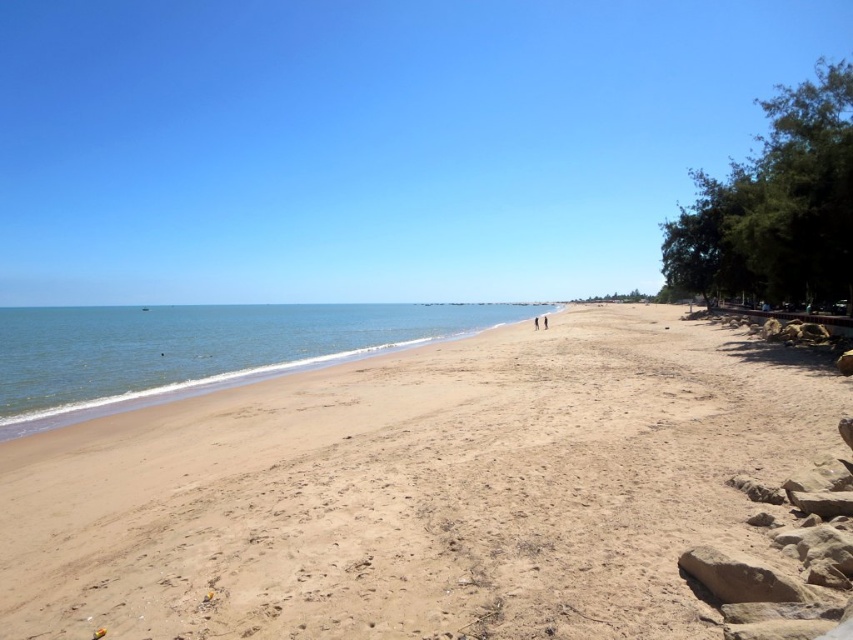
Between point (544, 321) and point (532, 326), which one is positioned behind?

The point (532, 326) is more distant.

Does skinny jeans at center come behind skinny person at center?

Yes.

Describe the element at coordinates (544, 321) in the screenshot. This screenshot has height=640, width=853. I see `skinny jeans at center` at that location.

Find the location of a particular element. skinny jeans at center is located at coordinates (544, 321).

Is light brown sand at center shorter than skinny person at center?

No, light brown sand at center is not shorter than skinny person at center.

Is light brown sand at center smaller than skinny person at center?

No, light brown sand at center is not smaller than skinny person at center.

Does point (408, 627) come behind point (534, 317)?

That is False.

Identify the location of light brown sand at center. (416, 492).

Does light brown sand at center appear on the left side of blue water at left?

Incorrect, light brown sand at center is not on the left side of blue water at left.

Between light brown sand at center and blue water at left, which one appears on the left side from the viewer's perspective?

Positioned to the left is blue water at left.

Is point (578, 628) more distant than point (309, 340)?

No.

Locate an element on the screen. The height and width of the screenshot is (640, 853). light brown sand at center is located at coordinates (416, 492).